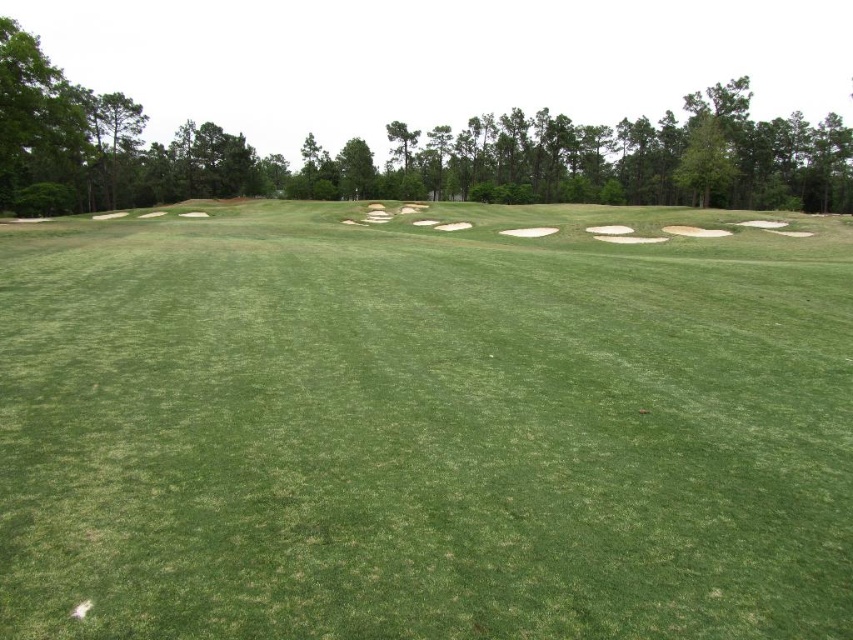
Question: Which object is closer to the camera taking this photo?

Choices:
 (A) green grassy field at center
 (B) white sand bunker at center

Answer: (A)

Question: Is green grassy field at center bigger than white sand bunker at center?

Choices:
 (A) no
 (B) yes

Answer: (B)

Question: Does green grassy field at center appear on the right side of white sand bunker at center?

Choices:
 (A) yes
 (B) no

Answer: (B)

Question: Does green grassy field at center appear on the left side of white sand bunker at center?

Choices:
 (A) no
 (B) yes

Answer: (B)